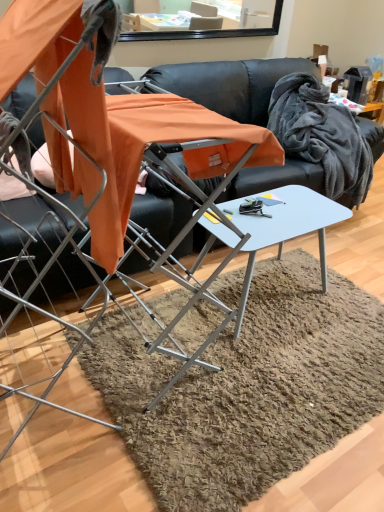
Measure the distance between point (203, 154) and camera.

Point (203, 154) and camera are 4.87 feet apart.

What do you see at coordinates (233, 84) in the screenshot? I see `black leather couch at center` at bounding box center [233, 84].

Measure the distance between white glossy table at center and camera.

white glossy table at center and camera are 4.38 feet apart.

This screenshot has width=384, height=512. What do you see at coordinates (287, 223) in the screenshot?
I see `white glossy table at center` at bounding box center [287, 223].

Where is `gray fluffy blanket at upper right`? Image resolution: width=384 pixels, height=512 pixels. gray fluffy blanket at upper right is located at coordinates (321, 135).

Locate an element on the screen. metallic silver folding chair at center is located at coordinates (97, 176).

Which is in front, point (200, 126) or point (293, 205)?

The point (200, 126) is more forward.

From the picture: Which is correct: metallic silver folding chair at center is inside white glossy table at center, or outside of it?

metallic silver folding chair at center is not enclosed by white glossy table at center.

Does metallic silver folding chair at center have a lesser height compared to white glossy table at center?

In fact, metallic silver folding chair at center may be taller than white glossy table at center.

This screenshot has width=384, height=512. In order to click on couch that appears below the gray fluffy blanket at upper right (from a real-world perspective) in this screenshot , I will do [233, 84].

From a real-world perspective, which object stands above the other?

gray fluffy blanket at upper right, from a real-world perspective.

Considering the relative sizes of gray fluffy blanket at upper right and black leather couch at center in the image provided, is gray fluffy blanket at upper right smaller than black leather couch at center?

Indeed, gray fluffy blanket at upper right has a smaller size compared to black leather couch at center.

Would you say gray fluffy blanket at upper right contains black leather couch at center?

Definitely not — black leather couch at center is not inside gray fluffy blanket at upper right.

Is gray fluffy blanket at upper right turned away from metallic silver folding chair at center?

No.

Looking at this image, considering the sizes of gray fluffy blanket at upper right and metallic silver folding chair at center in the image, is gray fluffy blanket at upper right bigger or smaller than metallic silver folding chair at center?

gray fluffy blanket at upper right is smaller than metallic silver folding chair at center.

From the image's perspective, is gray fluffy blanket at upper right above or below metallic silver folding chair at center?

Based on their image positions, gray fluffy blanket at upper right is located above metallic silver folding chair at center.

Is gray fluffy blanket at upper right wider or thinner than metallic silver folding chair at center?

Considering their sizes, gray fluffy blanket at upper right looks slimmer than metallic silver folding chair at center.

From a real-world perspective, is white glossy table at center below gray fluffy blanket at upper right?

Yes, from a real-world perspective, white glossy table at center is under gray fluffy blanket at upper right.

Is white glossy table at center beside gray fluffy blanket at upper right?

No.

Does white glossy table at center appear on the left side of gray fluffy blanket at upper right?

Yes, white glossy table at center is to the left of gray fluffy blanket at upper right.

From the image's perspective, is white glossy table at center above or below gray fluffy blanket at upper right?

From the image's perspective, white glossy table at center appears below gray fluffy blanket at upper right.

From the image's perspective, which is above, gray fluffy blanket at upper right or white glossy table at center?

gray fluffy blanket at upper right appears higher in the image.

Is gray fluffy blanket at upper right smaller than white glossy table at center?

Indeed, gray fluffy blanket at upper right has a smaller size compared to white glossy table at center.

What's the angular difference between gray fluffy blanket at upper right and white glossy table at center's facing directions?

gray fluffy blanket at upper right and white glossy table at center are facing 7.38 degrees away from each other.

Identify the location of fabric located above the white glossy table at center (from a real-world perspective). (321, 135).

From the picture: Could you tell me if black leather couch at center is turned towards metallic silver folding chair at center?

No, black leather couch at center is not aimed at metallic silver folding chair at center.

Can you tell me how much black leather couch at center and metallic silver folding chair at center differ in facing direction?

They differ by 2.55 degrees in their facing directions.

Can you confirm if black leather couch at center is bigger than metallic silver folding chair at center?

Correct, black leather couch at center is larger in size than metallic silver folding chair at center.

Considering the relative positions of black leather couch at center and metallic silver folding chair at center in the image provided, is black leather couch at center behind metallic silver folding chair at center?

Yes.

In the image, is black leather couch at center on the left side or the right side of gray fluffy blanket at upper right?

Clearly, black leather couch at center is on the left of gray fluffy blanket at upper right in the image.

Which of these two, black leather couch at center or gray fluffy blanket at upper right, stands taller?

black leather couch at center is taller.

Considering the positions of objects black leather couch at center and gray fluffy blanket at upper right in the image provided, who is behind, black leather couch at center or gray fluffy blanket at upper right?

gray fluffy blanket at upper right is more distant.

How many degrees apart are the facing directions of black leather couch at center and gray fluffy blanket at upper right?

There is a 8.55-degree angle between the facing directions of black leather couch at center and gray fluffy blanket at upper right.

Find the location of `chair lying in front of the white glossy table at center`. chair lying in front of the white glossy table at center is located at coordinates (97, 176).

This screenshot has height=512, width=384. I want to click on fabric lying on the right of black leather couch at center, so click(321, 135).

Which object lies nearer to the anchor point white glossy table at center, gray fluffy blanket at upper right or metallic silver folding chair at center?

metallic silver folding chair at center lies closer to white glossy table at center than the other object.

When comparing their distances from black leather couch at center, does gray fluffy blanket at upper right or white glossy table at center seem closer?

Based on the image, gray fluffy blanket at upper right appears to be nearer to black leather couch at center.

From the image, which object appears to be nearer to gray fluffy blanket at upper right, metallic silver folding chair at center or white glossy table at center?

Among the two, white glossy table at center is located nearer to gray fluffy blanket at upper right.

Looking at the image, which one is located further to black leather couch at center, white glossy table at center or metallic silver folding chair at center?

metallic silver folding chair at center lies further to black leather couch at center than the other object.

Which object lies further to the anchor point metallic silver folding chair at center, white glossy table at center or black leather couch at center?

Among the two, black leather couch at center is located further to metallic silver folding chair at center.

Considering their positions, is black leather couch at center positioned closer to gray fluffy blanket at upper right than metallic silver folding chair at center?

black leather couch at center is positioned closer to the anchor gray fluffy blanket at upper right.

Based on their spatial positions, is metallic silver folding chair at center or white glossy table at center further from black leather couch at center?

metallic silver folding chair at center is positioned further to the anchor black leather couch at center.

Considering their positions, is black leather couch at center positioned closer to gray fluffy blanket at upper right than white glossy table at center?

black leather couch at center lies closer to gray fluffy blanket at upper right than the other object.

The height and width of the screenshot is (512, 384). What are the coordinates of `couch between gray fluffy blanket at upper right and white glossy table at center in the vertical direction` in the screenshot? It's located at point(233,84).

The height and width of the screenshot is (512, 384). What are the coordinates of `round table between metallic silver folding chair at center and black leather couch at center along the z-axis` in the screenshot? It's located at (287, 223).

At what (x,y) coordinates should I click in order to perform the action: click on couch between metallic silver folding chair at center and gray fluffy blanket at upper right in the front-back direction. Please return your answer as a coordinate pair (x, y). The width and height of the screenshot is (384, 512). Looking at the image, I should click on (233, 84).

The height and width of the screenshot is (512, 384). Identify the location of round table positioned between metallic silver folding chair at center and gray fluffy blanket at upper right from near to far. (287, 223).